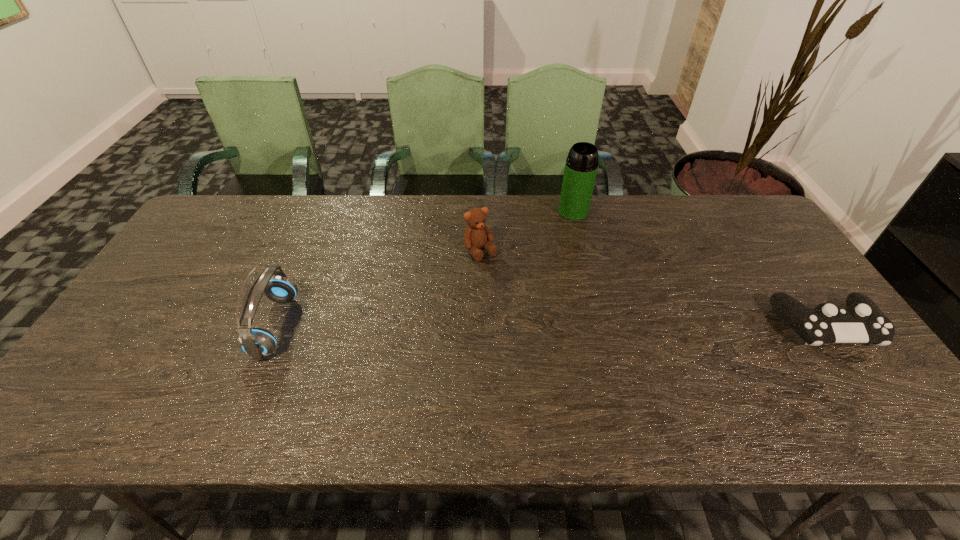
You are a GUI agent. You are given a task and a screenshot of the screen. Output one action in this format:
    pyautogui.click(x=<x>, y=<y>)
    Task: Click on the free spot between the farthest object and the second tallest object
    
    Given the screenshot: What is the action you would take?
    pyautogui.click(x=424, y=268)

Locate an element on the screen. The image size is (960, 540). vacant area that lies between the teddy bear and the second tallest object is located at coordinates (378, 288).

Locate an element on the screen. vacant region between the headset and the farthest object is located at coordinates (424, 268).

Image resolution: width=960 pixels, height=540 pixels. Find the location of `free space between the farthest object and the control`. free space between the farthest object and the control is located at coordinates click(700, 268).

Locate an element on the screen. Image resolution: width=960 pixels, height=540 pixels. free space between the third tallest object and the farthest object is located at coordinates (527, 231).

Identify which object is the nearest to the leftmost object. Please provide its 2D coordinates. Your answer should be formatted as a tuple, i.e. [(x, y)], where the tuple contains the x and y coordinates of a point satisfying the conditions above.

[(477, 234)]

Identify which object is the closest to the third nearest object. Please provide its 2D coordinates. Your answer should be formatted as a tuple, i.e. [(x, y)], where the tuple contains the x and y coordinates of a point satisfying the conditions above.

[(581, 165)]

The image size is (960, 540). I want to click on free location that satisfies the following two spatial constraints: 1. on the back side of the second object from left to right; 2. on the left side of the farthest object, so click(481, 211).